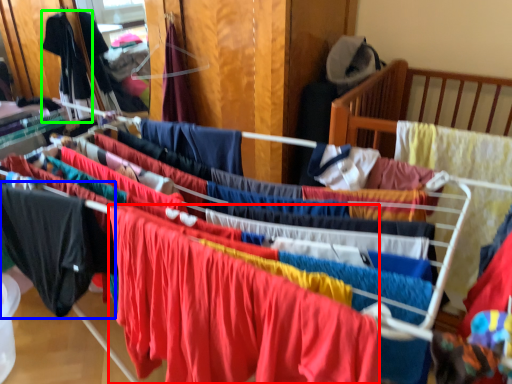
Question: Estimate the real-world distances between objects in this image. Which object is closer to clothing (highlighted by a red box), clothing (highlighted by a blue box) or clothing (highlighted by a green box)?

Choices:
 (A) clothing
 (B) clothing

Answer: (A)